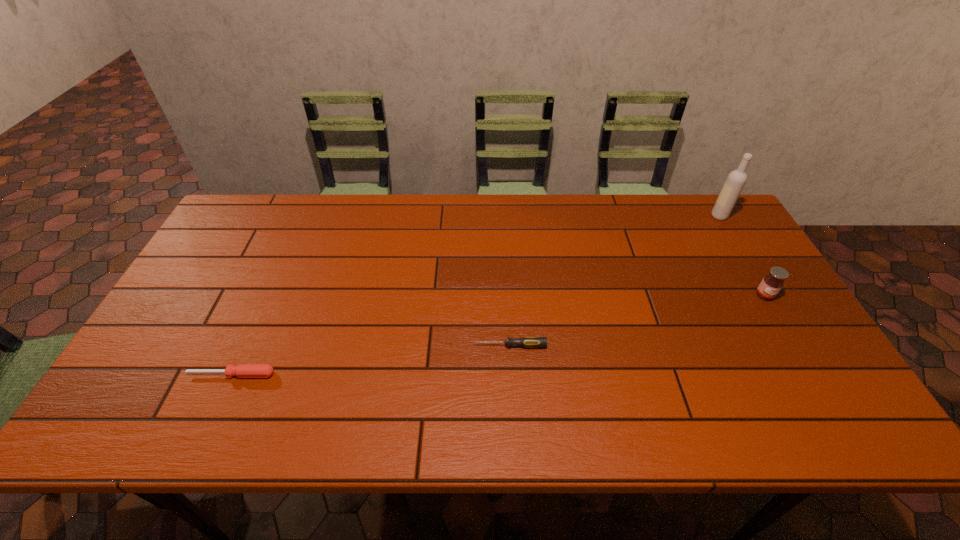
Where is `the tallest object`? The height and width of the screenshot is (540, 960). the tallest object is located at coordinates (736, 180).

At what (x,y) coordinates should I click in order to perform the action: click on the farthest object. Please return your answer as a coordinate pair (x, y). Looking at the image, I should click on (736, 180).

At what (x,y) coordinates should I click in order to perform the action: click on the second farthest object. Please return your answer as a coordinate pair (x, y). Looking at the image, I should click on (772, 283).

Where is `jam`? This screenshot has height=540, width=960. jam is located at coordinates (772, 283).

I want to click on the left screwdriver, so click(242, 370).

I want to click on the nearer screwdriver, so click(242, 370).

At what (x,y) coordinates should I click in order to perform the action: click on the third object from right to left. Please return your answer as a coordinate pair (x, y). This screenshot has width=960, height=540. Looking at the image, I should click on (525, 341).

Find the location of `the third farthest object`. the third farthest object is located at coordinates (525, 341).

Locate an element on the screen. Image resolution: width=960 pixels, height=540 pixels. free spot located on the left of the vodka is located at coordinates (672, 216).

I want to click on vacant region located on the label side of the second farthest object, so click(782, 325).